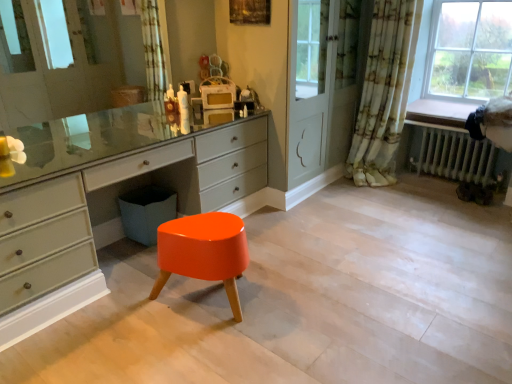
Question: Would you say glossy orange stool at center is to the left or to the right of floral fabric curtain at right in the picture?

Choices:
 (A) left
 (B) right

Answer: (A)

Question: Is glossy orange stool at center wider or thinner than floral fabric curtain at right?

Choices:
 (A) thin
 (B) wide

Answer: (B)

Question: Which object is the farthest from the velvet black swivel chair at right?

Choices:
 (A) glossy orange stool at center
 (B) metallic radiator at lower right
 (C) floral fabric curtain at right
 (D) matte gray chest of drawers at center

Answer: (A)

Question: Which object is the closest to the glossy orange stool at center?

Choices:
 (A) velvet black swivel chair at right
 (B) matte gray chest of drawers at center
 (C) floral fabric curtain at right
 (D) metallic radiator at lower right

Answer: (B)